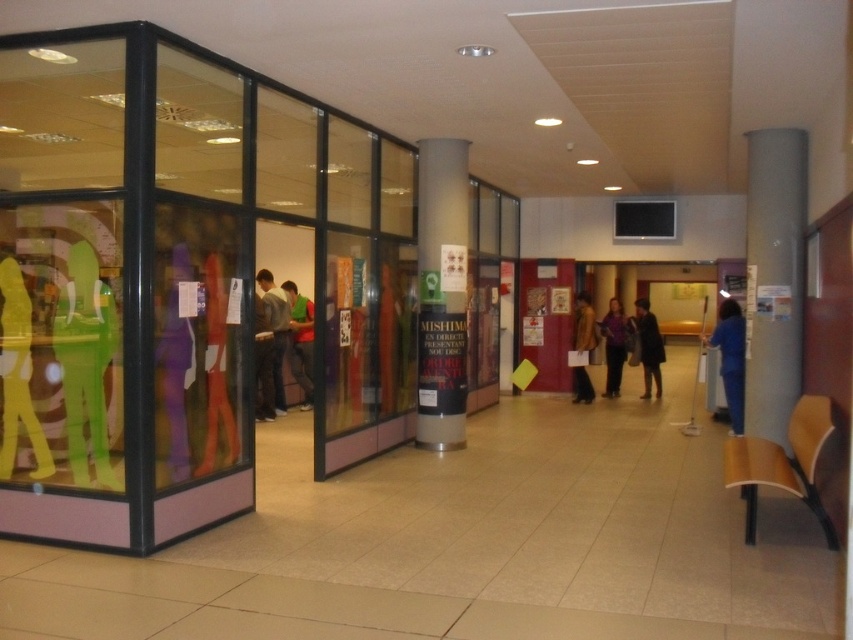
Question: Which of the following is the closest to the observer?

Choices:
 (A) brown leather jacket at center
 (B) metallic silver pillar at center
 (C) dark gray sweater at center
 (D) blue fabric person at right

Answer: (B)

Question: Can you confirm if metallic silver pillar at center is thinner than dark gray sweater at center?

Choices:
 (A) yes
 (B) no

Answer: (B)

Question: Which of the following is the closest to the observer?

Choices:
 (A) metallic silver pillar at center
 (B) gray matte pillar at right
 (C) brown leather jacket at center
 (D) blue fabric person at right

Answer: (B)

Question: Does metallic silver pillar at center lie behind dark brown leather coat at center?

Choices:
 (A) yes
 (B) no

Answer: (B)

Question: In this image, where is metallic silver pillar at center located relative to purple matte dress at center?

Choices:
 (A) right
 (B) left

Answer: (B)

Question: Which point is closer to the camera?

Choices:
 (A) brown leather jacket at center
 (B) gray matte pillar at right
 (C) dark gray sweater at center
 (D) blue fabric person at right

Answer: (B)